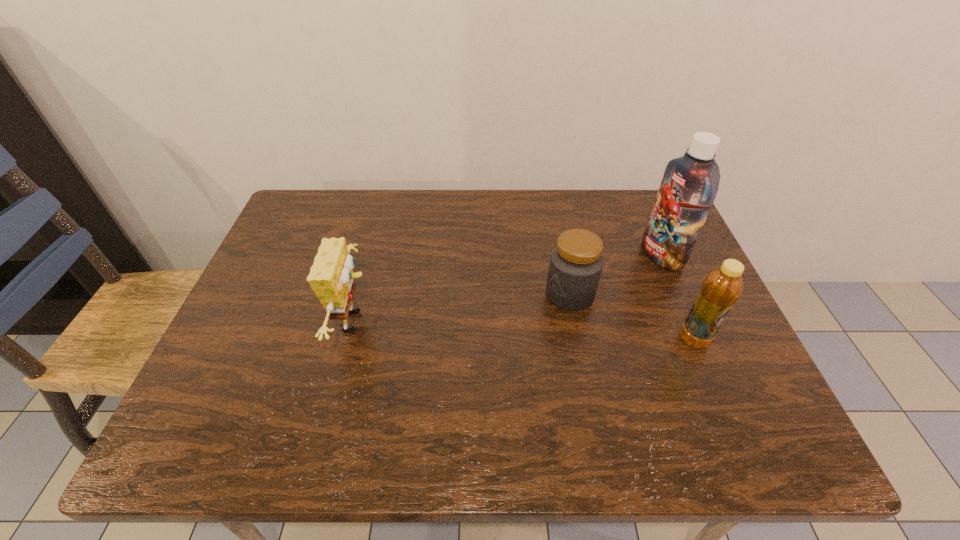
The width and height of the screenshot is (960, 540). In the image, there is a desktop. What are the coordinates of `free space at the far left corner` in the screenshot? It's located at 297,231.

You are a GUI agent. You are given a task and a screenshot of the screen. Output one action in this format:
    pyautogui.click(x=<x>, y=<y>)
    Task: Click on the free space between the farthest object and the shortest object
    
    Given the screenshot: What is the action you would take?
    pyautogui.click(x=615, y=275)

In order to click on free point between the shampoo and the second object from left to right in this screenshot , I will do `click(615, 275)`.

The image size is (960, 540). What are the coordinates of `free area in between the farthest object and the sponge` in the screenshot? It's located at (509, 288).

Where is `vacant area between the sponge and the shortest object`? This screenshot has height=540, width=960. vacant area between the sponge and the shortest object is located at coordinates (463, 308).

Where is `vacant area that lies between the second object from left to right and the bottle`? The image size is (960, 540). vacant area that lies between the second object from left to right and the bottle is located at coordinates (632, 317).

Identify the location of vacant area between the bottle and the shortest object. The height and width of the screenshot is (540, 960). click(x=632, y=317).

This screenshot has width=960, height=540. I want to click on unoccupied area between the third object from right to left and the sponge, so click(463, 308).

The width and height of the screenshot is (960, 540). What are the coordinates of `vacant space that's between the third object from right to left and the farthest object` in the screenshot? It's located at (615, 275).

Where is `vacant point located between the tallest object and the bottle`? This screenshot has height=540, width=960. vacant point located between the tallest object and the bottle is located at coordinates (678, 298).